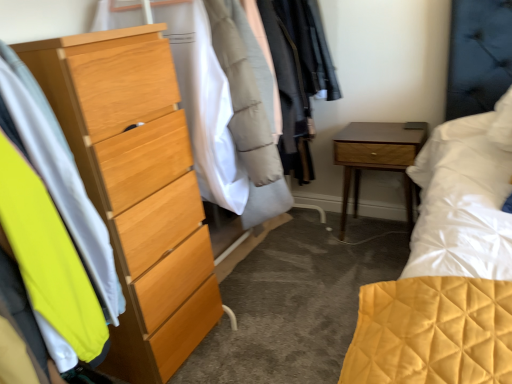
Describe the element at coordinates (136, 188) in the screenshot. This screenshot has height=384, width=512. I see `light wood dresser at left` at that location.

You are a GUI agent. You are given a task and a screenshot of the screen. Output one action in this format:
    pyautogui.click(x=<x>, y=<y>)
    Task: Click on the neon yellow fabric at left
    The width and height of the screenshot is (512, 384).
    Given the screenshot: What is the action you would take?
    pyautogui.click(x=60, y=177)

Where is `wooden nightstand at lower right`? The image size is (512, 384). wooden nightstand at lower right is located at coordinates (377, 159).

Is light wood dresser at left to the right of wooden nightstand at lower right from the viewer's perspective?

No, light wood dresser at left is not to the right of wooden nightstand at lower right.

Who is bigger, light wood dresser at left or wooden nightstand at lower right?

light wood dresser at left is bigger.

Is light wood dresser at left facing away from wooden nightstand at lower right?

That's not correct — light wood dresser at left is not looking away from wooden nightstand at lower right.

Where is `chest of drawers in front of the wooden nightstand at lower right`? This screenshot has height=384, width=512. chest of drawers in front of the wooden nightstand at lower right is located at coordinates (136, 188).

Would you say light wood dresser at left is part of neon yellow fabric at left's contents?

No, light wood dresser at left is not inside neon yellow fabric at left.

Is neon yellow fabric at left positioned far away from light wood dresser at left?

They are positioned close to each other.

Is neon yellow fabric at left taller than light wood dresser at left?

No, neon yellow fabric at left is not taller than light wood dresser at left.

From the image's perspective, is neon yellow fabric at left over wooden nightstand at lower right?

No, from the image's perspective, neon yellow fabric at left is not on top of wooden nightstand at lower right.

Is neon yellow fabric at left placed right next to wooden nightstand at lower right?

No, neon yellow fabric at left is not in contact with wooden nightstand at lower right.

Can you tell me how much neon yellow fabric at left and wooden nightstand at lower right differ in facing direction?

The angle between the facing direction of neon yellow fabric at left and the facing direction of wooden nightstand at lower right is 89.8 degrees.

Is neon yellow fabric at left facing towards wooden nightstand at lower right?

No, neon yellow fabric at left does not turn towards wooden nightstand at lower right.

Is light wood dresser at left to the left of neon yellow fabric at left from the viewer's perspective?

Incorrect, light wood dresser at left is not on the left side of neon yellow fabric at left.

Is neon yellow fabric at left located within light wood dresser at left?

No, neon yellow fabric at left is located outside of light wood dresser at left.

Is wooden nightstand at lower right oriented away from light wood dresser at left?

No, wooden nightstand at lower right is not facing away from light wood dresser at left.

From the image's perspective, is wooden nightstand at lower right located above light wood dresser at left?

Indeed, from the image's perspective, wooden nightstand at lower right is shown above light wood dresser at left.

Between wooden nightstand at lower right and light wood dresser at left, which one has larger size?

light wood dresser at left.

The image size is (512, 384). In the image, there is a neon yellow fabric at left. Find the location of `nightstand above it (from the image's perspective)`. nightstand above it (from the image's perspective) is located at coordinates (377, 159).

Who is smaller, wooden nightstand at lower right or neon yellow fabric at left?

With smaller size is neon yellow fabric at left.

Which point is more distant from viewer, (358, 153) or (46, 186)?

Point (358, 153)

Which of these two, wooden nightstand at lower right or neon yellow fabric at left, is thinner?

Thinner between the two is neon yellow fabric at left.

Find the location of a particular element. The image size is (512, 384). nightstand below the light wood dresser at left (from a real-world perspective) is located at coordinates (377, 159).

Identify the location of clothing that is in front of the light wood dresser at left. (60, 177).

Looking at this image, based on their spatial positions, is wooden nightstand at lower right or neon yellow fabric at left further from light wood dresser at left?

The object further to light wood dresser at left is wooden nightstand at lower right.

Estimate the real-world distances between objects in this image. Which object is further from wooden nightstand at lower right, neon yellow fabric at left or light wood dresser at left?

Based on the image, neon yellow fabric at left appears to be further to wooden nightstand at lower right.

From the image, which object appears to be nearer to light wood dresser at left, neon yellow fabric at left or wooden nightstand at lower right?

The object closer to light wood dresser at left is neon yellow fabric at left.

Which object lies further to the anchor point wooden nightstand at lower right, light wood dresser at left or neon yellow fabric at left?

The object further to wooden nightstand at lower right is neon yellow fabric at left.

Based on their spatial positions, is wooden nightstand at lower right or light wood dresser at left further from neon yellow fabric at left?

Based on the image, wooden nightstand at lower right appears to be further to neon yellow fabric at left.

Based on their spatial positions, is light wood dresser at left or wooden nightstand at lower right further from neon yellow fabric at left?

Based on the image, wooden nightstand at lower right appears to be further to neon yellow fabric at left.

I want to click on chest of drawers between neon yellow fabric at left and wooden nightstand at lower right from left to right, so click(x=136, y=188).